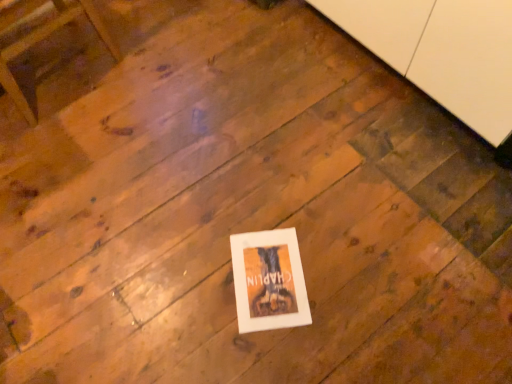
This screenshot has width=512, height=384. Identify the location of vacant space underneath wooden chair at upper left (from a real-world perspective). (56, 55).